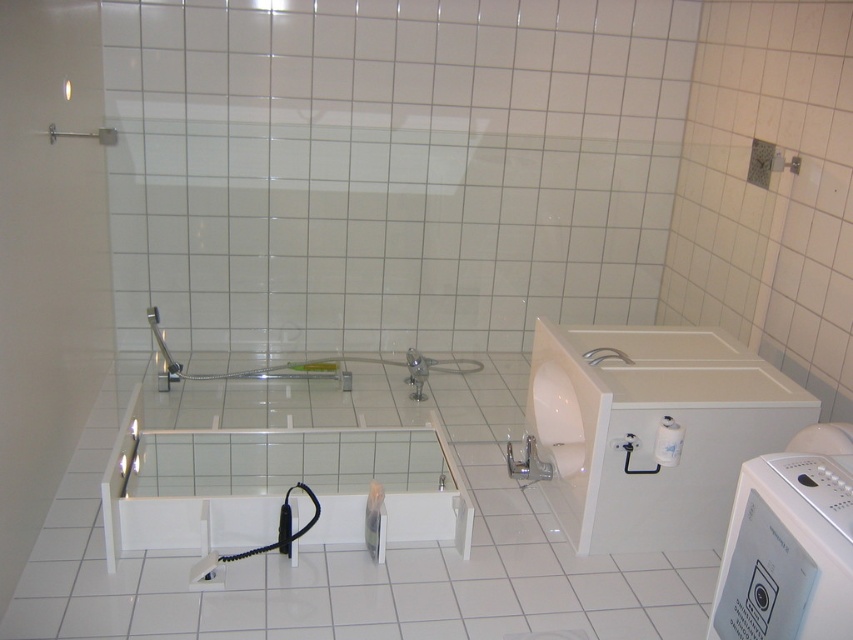
Can you confirm if white glossy washing machine at right is positioned to the right of white plastic washing machine at lower right?

Incorrect, white glossy washing machine at right is not on the right side of white plastic washing machine at lower right.

Can you confirm if white glossy washing machine at right is smaller than white plastic washing machine at lower right?

Incorrect, white glossy washing machine at right is not smaller in size than white plastic washing machine at lower right.

Locate an element on the screen. white glossy washing machine at right is located at coordinates (653, 429).

Between white glossy washing machine at right and white glossy bathtub at center, which one is positioned higher?

white glossy washing machine at right is higher up.

This screenshot has height=640, width=853. What are the coordinates of `white glossy washing machine at right` in the screenshot? It's located at (653, 429).

Who is more forward, (578,396) or (437,534)?

Point (578,396)

This screenshot has height=640, width=853. I want to click on white glossy washing machine at right, so click(x=653, y=429).

Can you confirm if white glossy bathtub at center is wider than white plastic washing machine at lower right?

Indeed, white glossy bathtub at center has a greater width compared to white plastic washing machine at lower right.

Who is positioned more to the left, white glossy bathtub at center or white plastic washing machine at lower right?

Positioned to the left is white glossy bathtub at center.

Does point (260, 486) come behind point (846, 568)?

Yes, it is.

Where is `white glossy bathtub at center`? white glossy bathtub at center is located at coordinates (279, 486).